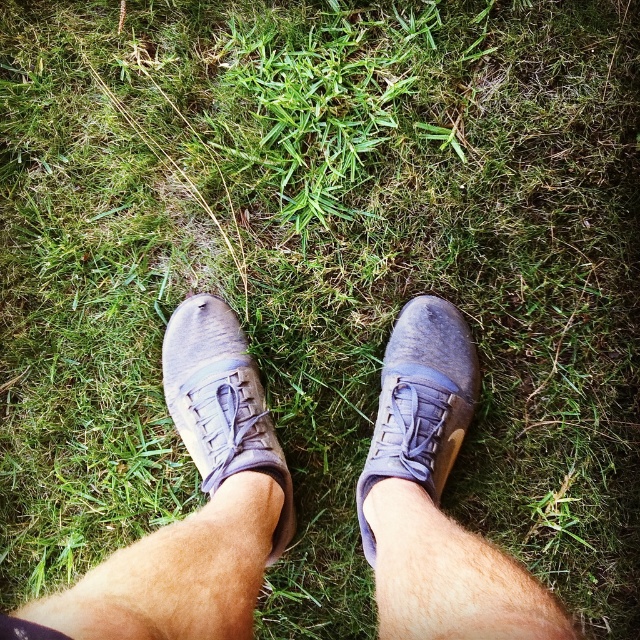
Between leather shoes at center and matte gray shoe at center, which one is positioned higher?

matte gray shoe at center is above.

Who is more distant from viewer, (150, 602) or (163, 381)?

The point (163, 381) is more distant.

I want to click on leather shoes at center, so click(195, 512).

Can you confirm if matte gray shoe at center is positioned to the left of matte leather shoe at center?

Indeed, matte gray shoe at center is positioned on the left side of matte leather shoe at center.

Measure the distance between matte gray shoe at center and camera.

The distance of matte gray shoe at center from camera is 4.11 feet.

Find the location of a particular element. Image resolution: width=640 pixels, height=640 pixels. matte gray shoe at center is located at coordinates (221, 403).

At what (x,y) coordinates should I click in order to perform the action: click on matte gray shoe at center. Please return your answer as a coordinate pair (x, y). This screenshot has width=640, height=640. Looking at the image, I should click on (221, 403).

Which of these two, leather shoes at center or matte leather shoe at center, stands shorter?

With less height is matte leather shoe at center.

Is leather shoes at center to the left of matte leather shoe at center from the viewer's perspective?

Correct, you'll find leather shoes at center to the left of matte leather shoe at center.

Locate an element on the screen. The height and width of the screenshot is (640, 640). leather shoes at center is located at coordinates (195, 512).